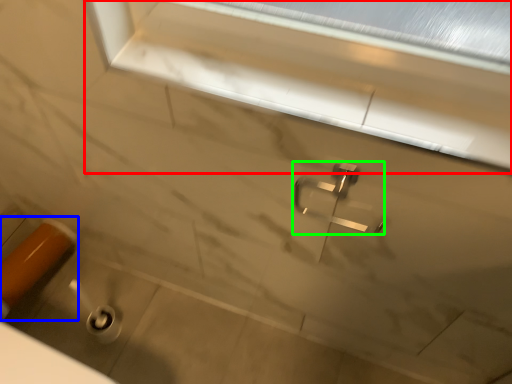
Question: Estimate the real-world distances between objects in this image. Which object is farther from window frame (highlighted by a red box), door handle (highlighted by a blue box) or tap (highlighted by a green box)?

Choices:
 (A) door handle
 (B) tap

Answer: (A)